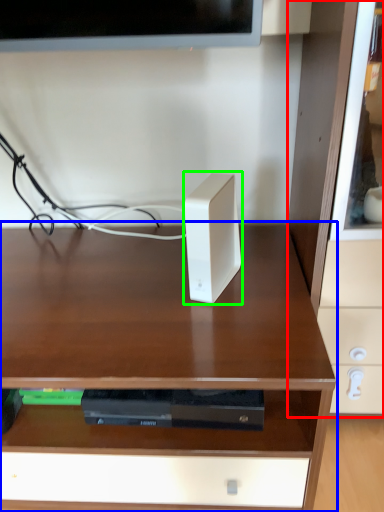
Question: Which object is the farthest from dresser (highlighted by a red box)? Choose among these: desk (highlighted by a blue box) or ipod (highlighted by a green box).

Choices:
 (A) desk
 (B) ipod

Answer: (A)